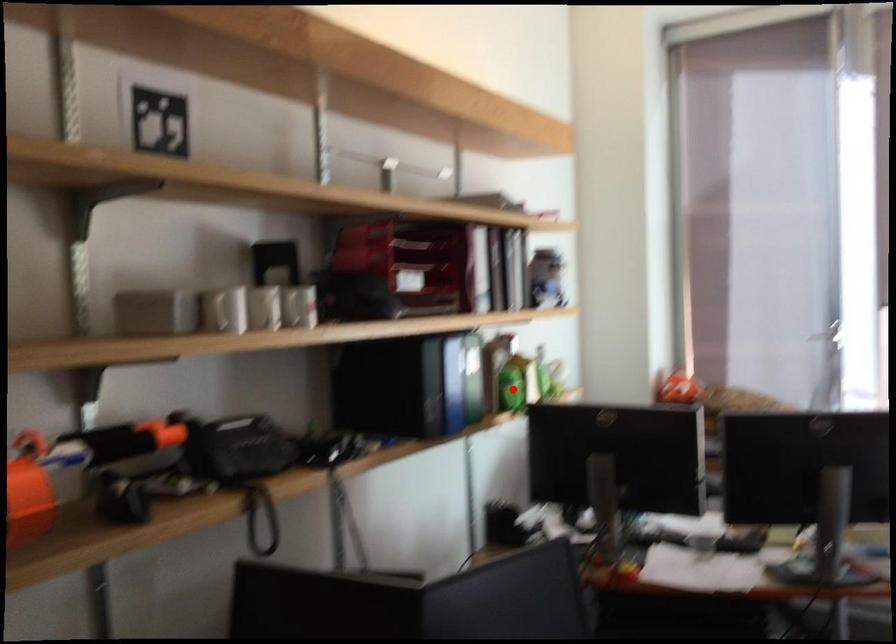
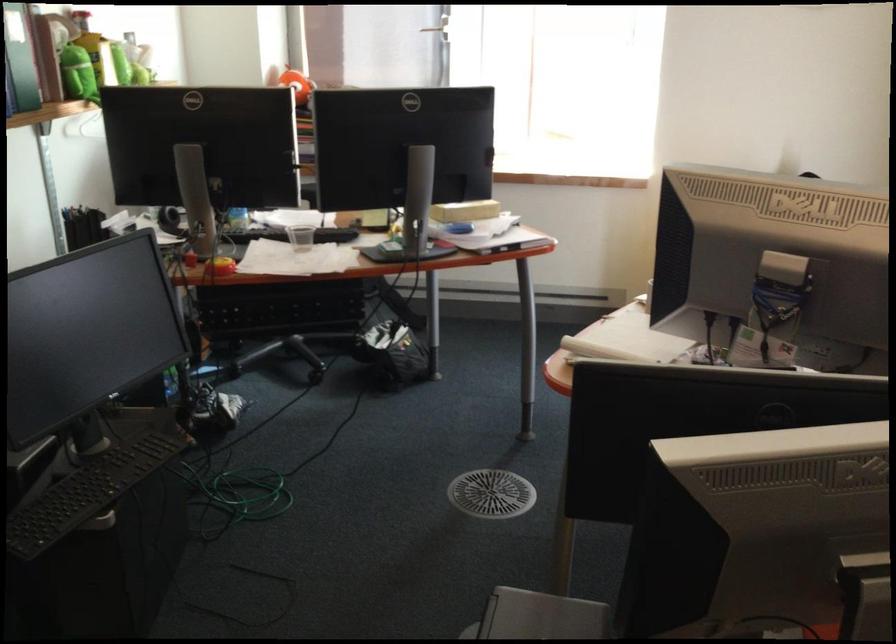
In the second image, find the point that corresponds to the highlighted location in the first image.

(78, 73)